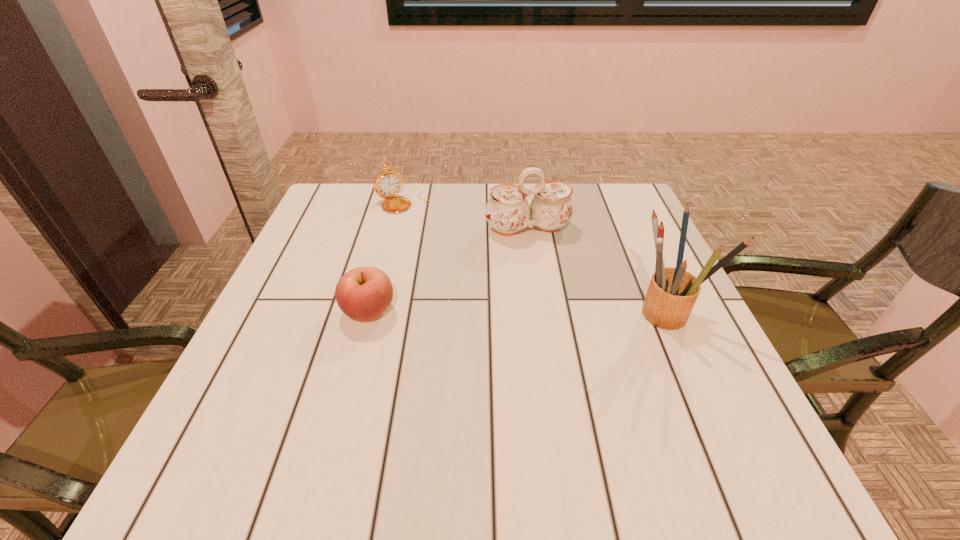
At what (x,y) coordinates should I click in order to perform the action: click on free space on the desktop that is between the apple and the pencil box and is positioned on the face of the farthest object. Please return your answer as a coordinate pair (x, y). The height and width of the screenshot is (540, 960). Looking at the image, I should click on (509, 312).

The width and height of the screenshot is (960, 540). I want to click on free space on the desktop that is between the apple and the pencil box and is positioned by the handle of the second tallest object, so click(x=560, y=312).